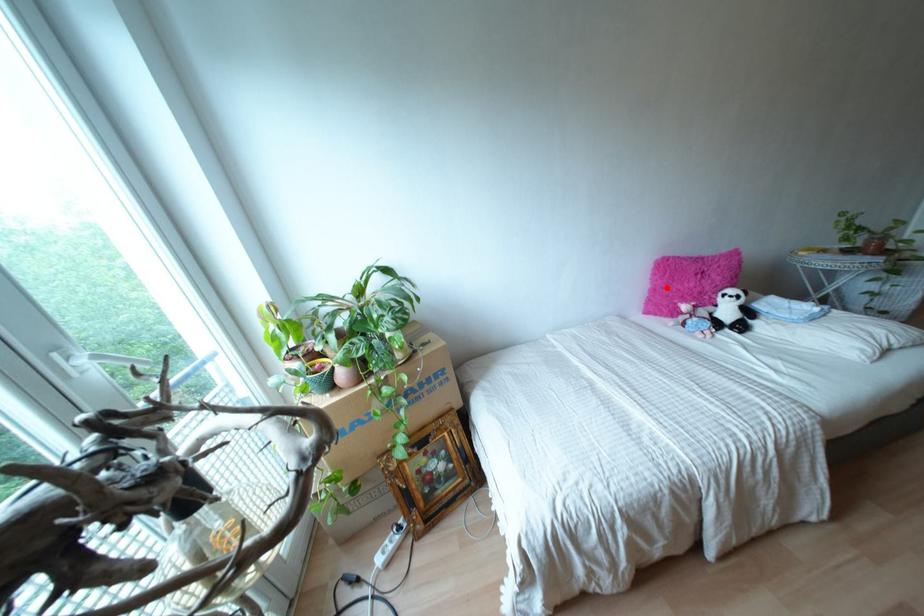
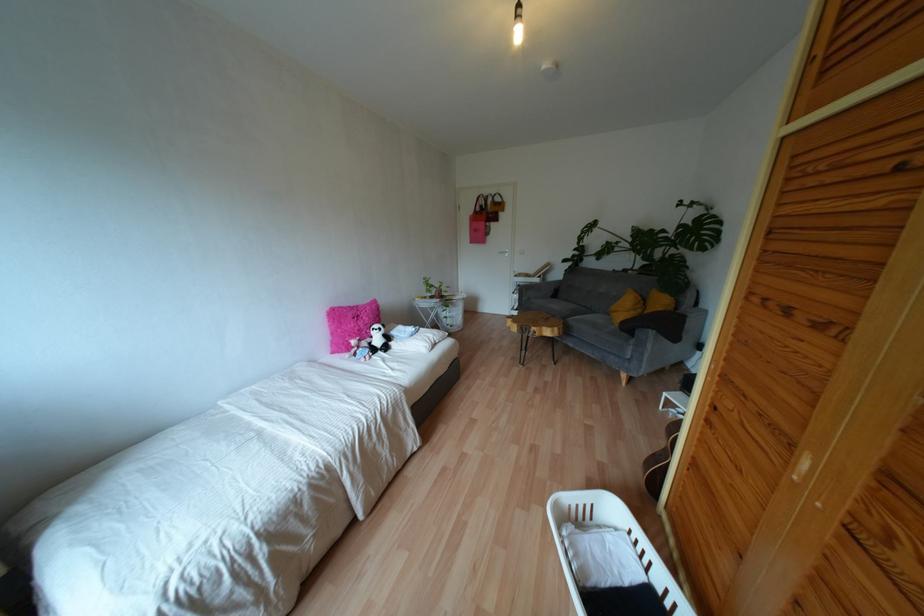
In the second image, find the point that corresponds to the highlighted location in the first image.

(338, 330)